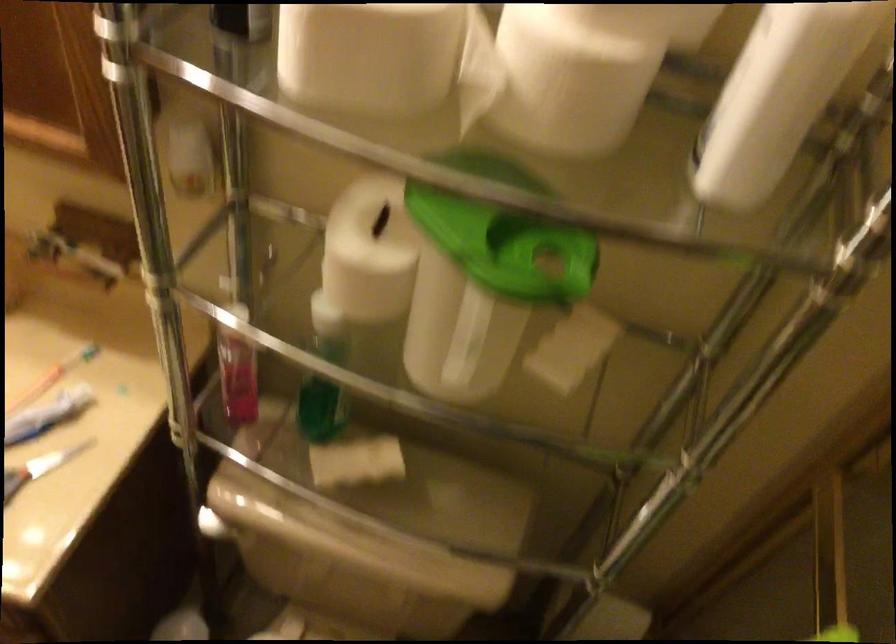
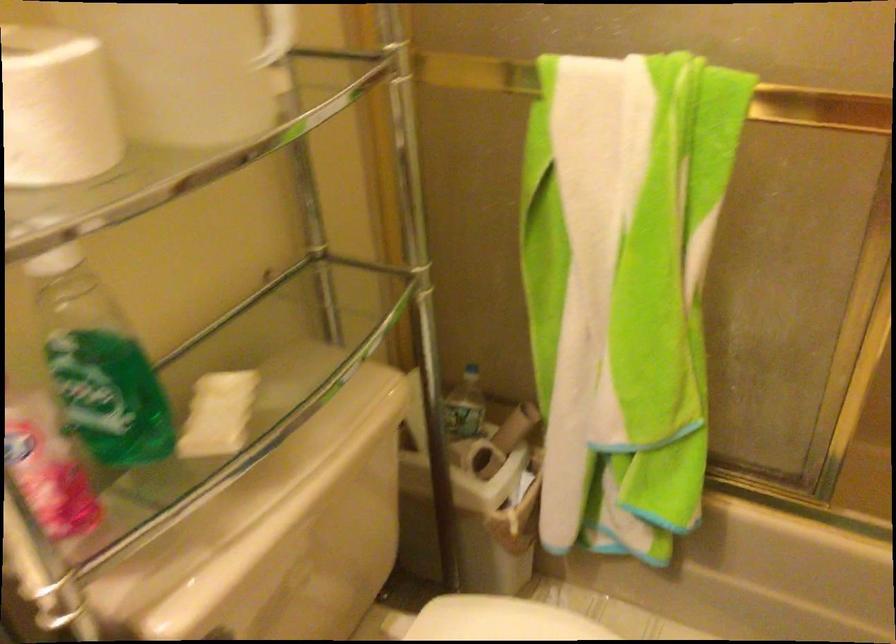
Locate, in the second image, the point that corresponds to [593,351] in the first image.

(270, 64)